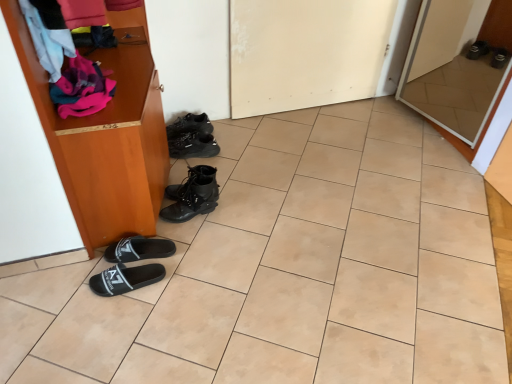
Find the location of a particular element. This screenshot has width=512, height=384. vacant area that is in front of black leather sneakers at center, the second footwear in the back-to-front sequence is located at coordinates (195, 173).